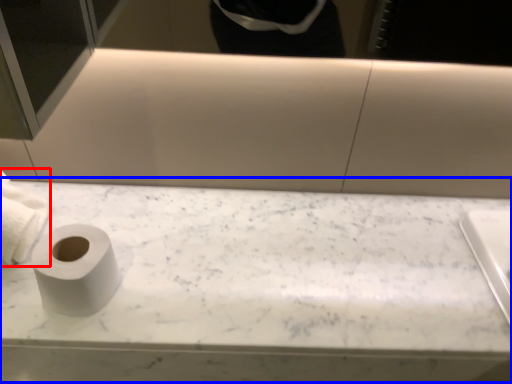
Question: Which object appears farthest to the camera in this image, toilet paper (highlighted by a red box) or counter top (highlighted by a blue box)?

Choices:
 (A) toilet paper
 (B) counter top

Answer: (B)